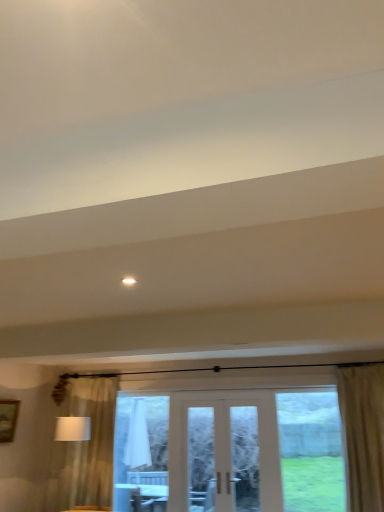
Question: From the image's perspective, relative to white fabric at center, is white glossy light at upper center above or below?

Choices:
 (A) below
 (B) above

Answer: (B)

Question: In the image, is white glossy light at upper center positioned in front of or behind white fabric at center?

Choices:
 (A) front
 (B) behind

Answer: (A)

Question: Which is farther from the clear glass window at center?

Choices:
 (A) wooden picture frame at left
 (B) clear glass door at center
 (C) white fabric lampshade at left
 (D) white glossy light at upper center
 (E) beige textured curtain at right

Answer: (D)

Question: Estimate the real-world distances between objects in this image. Which object is farther from the white fabric lampshade at left?

Choices:
 (A) white glossy light at upper center
 (B) clear glass window at center
 (C) beige textured curtain at right
 (D) wooden picture frame at left
 (E) clear glass door at center

Answer: (A)